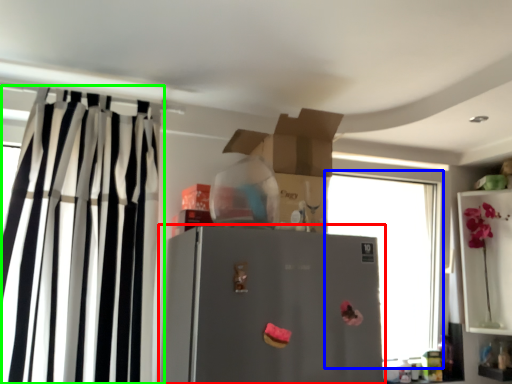
Question: Considering the real-world distances, which object is closest to refrigerator (highlighted by a red box)? window (highlighted by a blue box) or curtain (highlighted by a green box).

Choices:
 (A) window
 (B) curtain

Answer: (B)